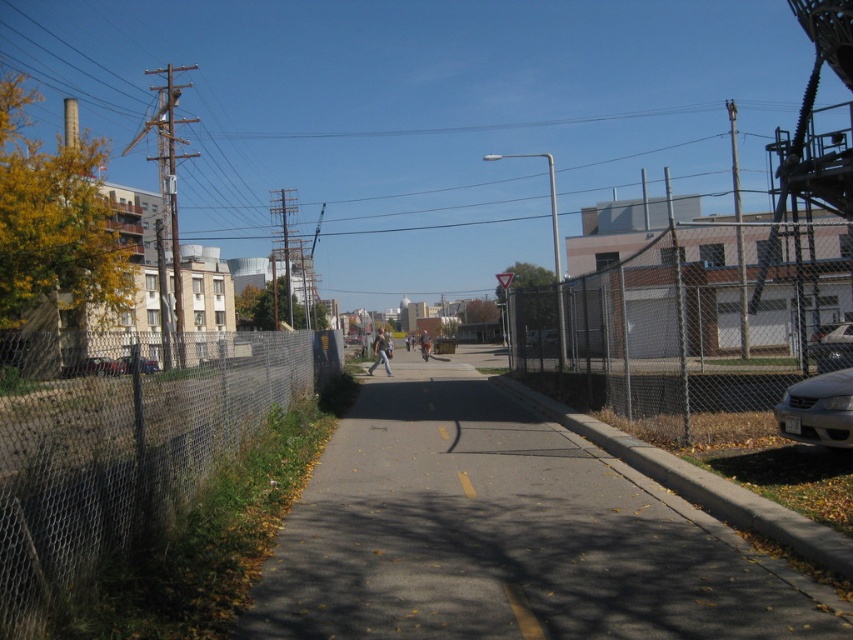
Question: Is gray asphalt pavement at center bigger than chain-link fence at right?

Choices:
 (A) no
 (B) yes

Answer: (A)

Question: Is rusty chain-link fence at left closer to the viewer compared to silver metallic sedan at right?

Choices:
 (A) yes
 (B) no

Answer: (A)

Question: Which point is farther to the camera?

Choices:
 (A) (836, 328)
 (B) (845, 428)
 (C) (381, 333)
 (D) (764, 593)

Answer: (C)

Question: Can you confirm if gray asphalt pavement at center is positioned above light blue jeans at center?

Choices:
 (A) no
 (B) yes

Answer: (A)

Question: Which point is closer to the camera?

Choices:
 (A) (851, 433)
 (B) (816, 369)

Answer: (A)

Question: Which object is positioned closest to the rusty chain-link fence at left?

Choices:
 (A) silver metallic sedan at right
 (B) white glossy sedan at right
 (C) gray asphalt pavement at center

Answer: (C)